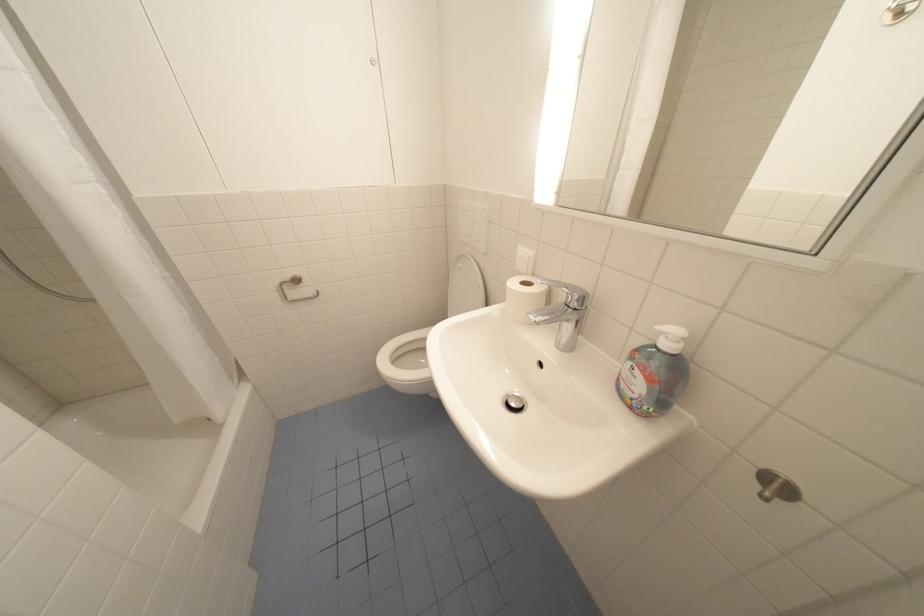
Where would you pull the cabinet door handle? Please return your answer as a coordinate pair (x, y).

(775, 487)